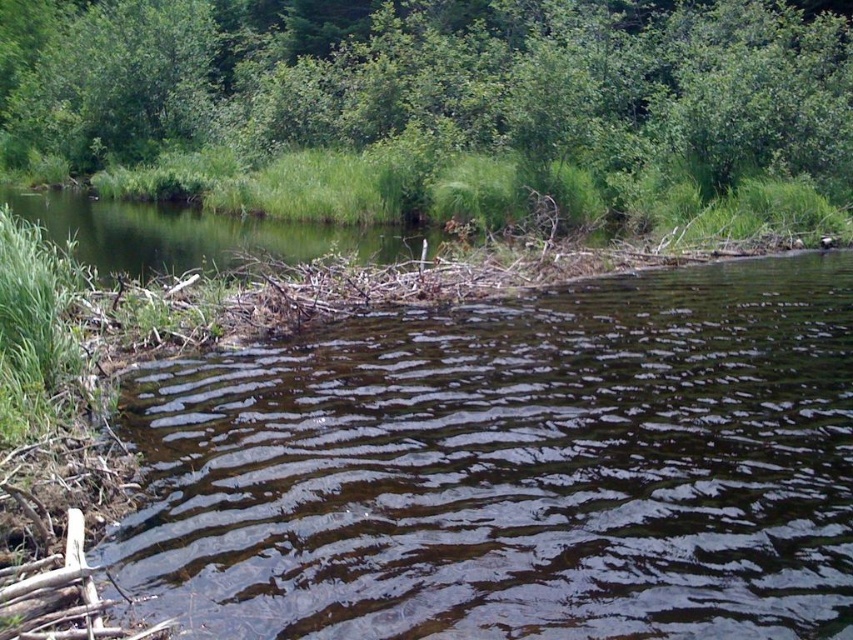
Is green leafy tree at upper center to the left of green grassy river at upper left from the viewer's perspective?

Incorrect, green leafy tree at upper center is not on the left side of green grassy river at upper left.

Which is behind, point (685, 152) or point (227, 250)?

Positioned behind is point (685, 152).

This screenshot has width=853, height=640. I want to click on green leafy tree at upper center, so click(426, 100).

At what (x,y) coordinates should I click in order to perform the action: click on brown/textured water at center. Please return your answer as a coordinate pair (x, y). Image resolution: width=853 pixels, height=640 pixels. Looking at the image, I should click on pyautogui.click(x=514, y=467).

Does point (720, 556) come farther from viewer compared to point (189, 221)?

No.

Does point (758, 429) come in front of point (300, 225)?

That is True.

Locate an element on the screen. The image size is (853, 640). brown/textured water at center is located at coordinates click(514, 467).

Measure the distance between brown/textured water at center and green leafy tree at upper center.

brown/textured water at center and green leafy tree at upper center are 23.60 meters apart.

Can you confirm if brown/textured water at center is bigger than green leafy tree at upper center?

Incorrect, brown/textured water at center is not larger than green leafy tree at upper center.

What do you see at coordinates (514, 467) in the screenshot? The height and width of the screenshot is (640, 853). I see `brown/textured water at center` at bounding box center [514, 467].

The width and height of the screenshot is (853, 640). Find the location of `brown/textured water at center`. brown/textured water at center is located at coordinates point(514,467).